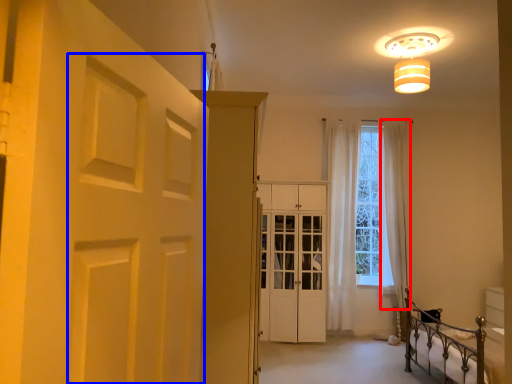
Question: Which of the following is the farthest to the observer, curtain (highlighted by a red box) or shutter (highlighted by a blue box)?

Choices:
 (A) curtain
 (B) shutter

Answer: (A)